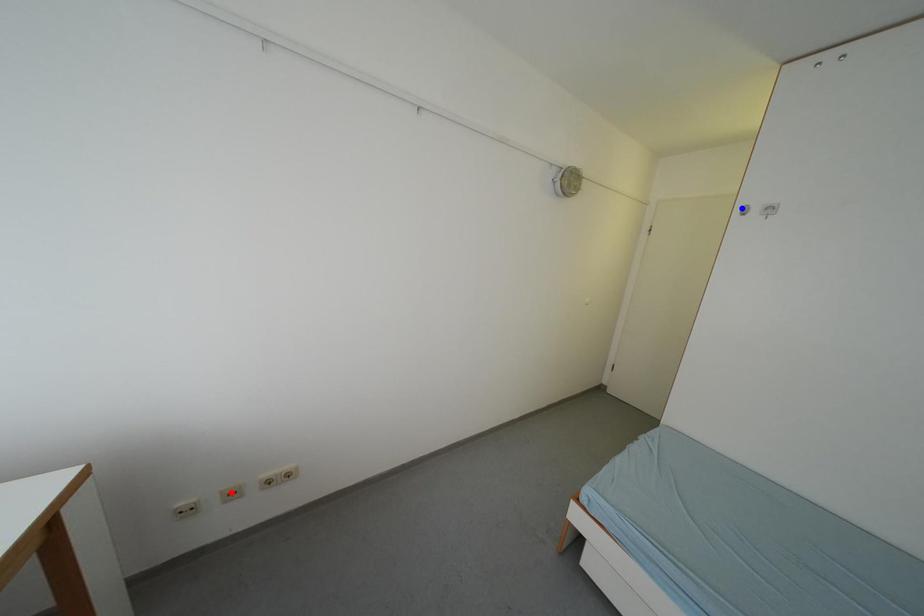
Question: In the image, two points are highlighted. Which point is nearer to the camera? Reply with the corresponding letter.

Choices:
 (A) blue point
 (B) red point

Answer: (B)